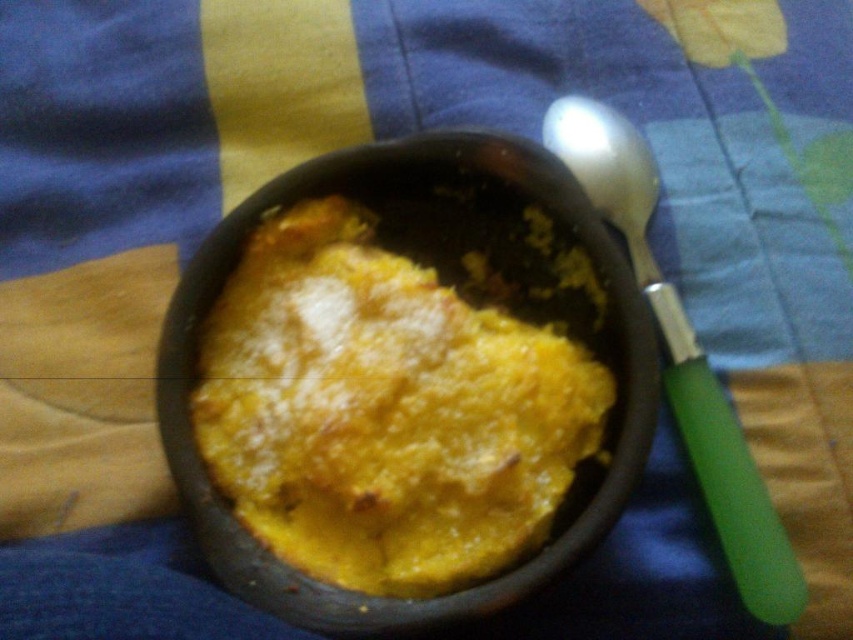
Does yellow matte cake at center have a greater height compared to green plastic spoon at right?

No.

Is point (508, 468) closer to viewer compared to point (601, 163)?

Yes, point (508, 468) is closer to viewer.

Who is more distant from viewer, (251, 456) or (720, 508)?

The point (251, 456) is behind.

At what (x,y) coordinates should I click in order to perform the action: click on yellow matte cake at center. Please return your answer as a coordinate pair (x, y). Looking at the image, I should click on (387, 408).